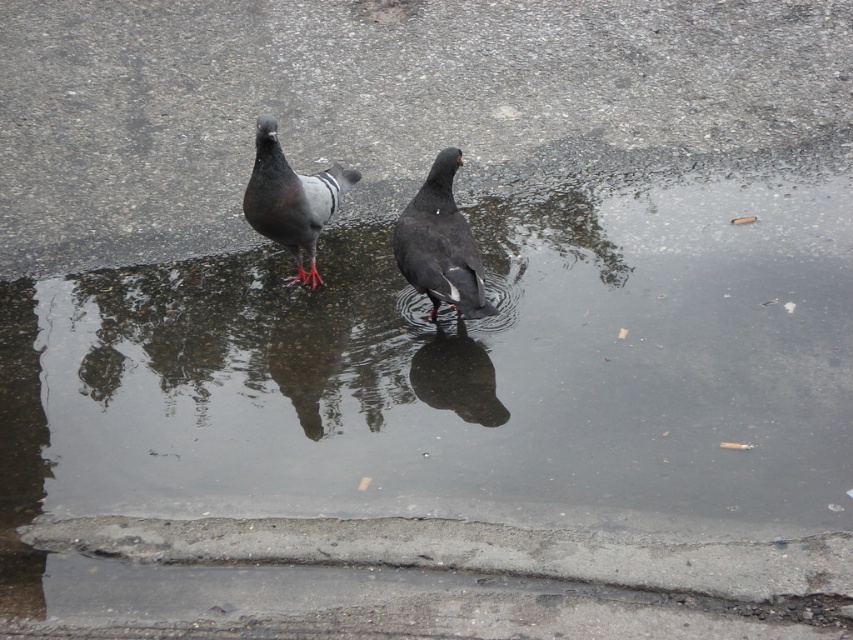
Question: Among these objects, which one is farthest from the camera?

Choices:
 (A) gray matte pigeon at center
 (B) matte black pigeon at center
 (C) shiny black bird at center

Answer: (A)

Question: Which of the following is the closest to the observer?

Choices:
 (A) (468, 228)
 (B) (419, 392)

Answer: (B)

Question: Does gray matte pigeon at center lie in front of shiny black bird at center?

Choices:
 (A) no
 (B) yes

Answer: (A)

Question: Can you confirm if matte black pigeon at center is bigger than gray matte pigeon at center?

Choices:
 (A) no
 (B) yes

Answer: (A)

Question: Which of the following is the closest to the observer?

Choices:
 (A) gray matte pigeon at center
 (B) matte black pigeon at center

Answer: (B)

Question: Does matte black pigeon at center appear over shiny black bird at center?

Choices:
 (A) yes
 (B) no

Answer: (A)